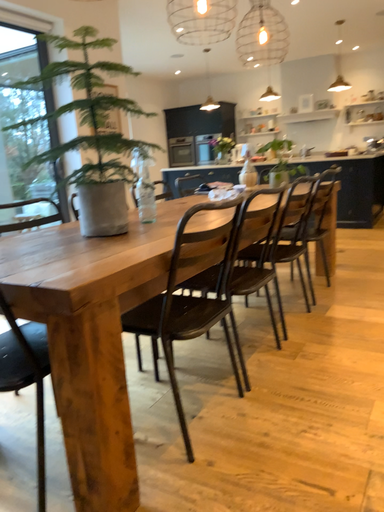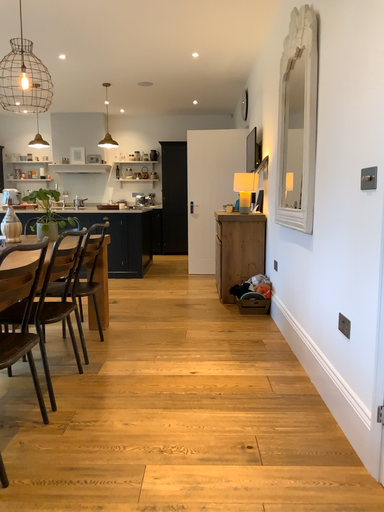
Question: Which way did the camera rotate in the video?

Choices:
 (A) rotated right
 (B) rotated left

Answer: (A)